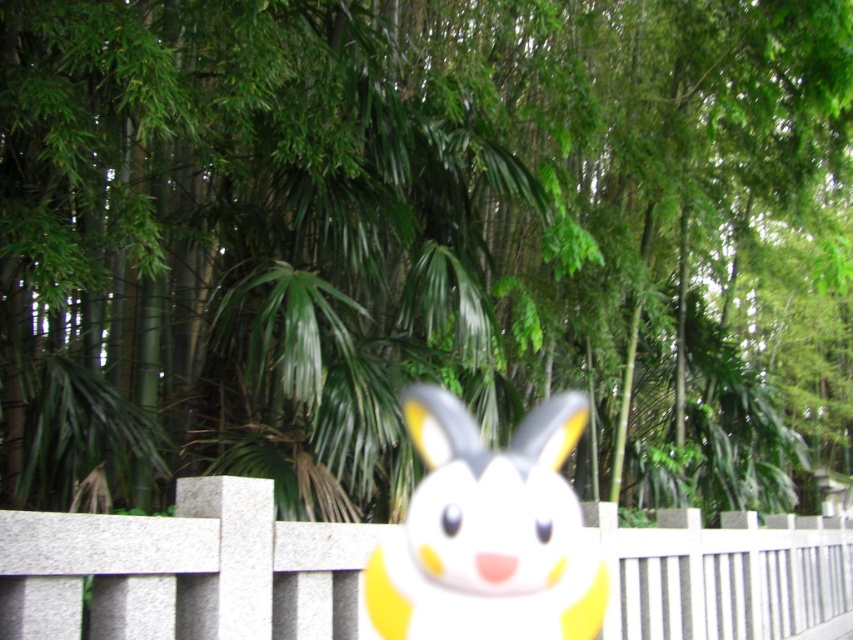
Question: Does white stone fence at center appear on the left side of yellow matte bunny at center?

Choices:
 (A) no
 (B) yes

Answer: (B)

Question: Can you confirm if white stone fence at center is wider than yellow matte bunny at center?

Choices:
 (A) yes
 (B) no

Answer: (B)

Question: Is white stone fence at center to the left of yellow matte bunny at center from the viewer's perspective?

Choices:
 (A) yes
 (B) no

Answer: (A)

Question: Which point is closer to the camera?

Choices:
 (A) (675, 536)
 (B) (413, 618)

Answer: (B)

Question: Which point appears farthest from the camera in this image?

Choices:
 (A) (509, 472)
 (B) (259, 586)

Answer: (A)